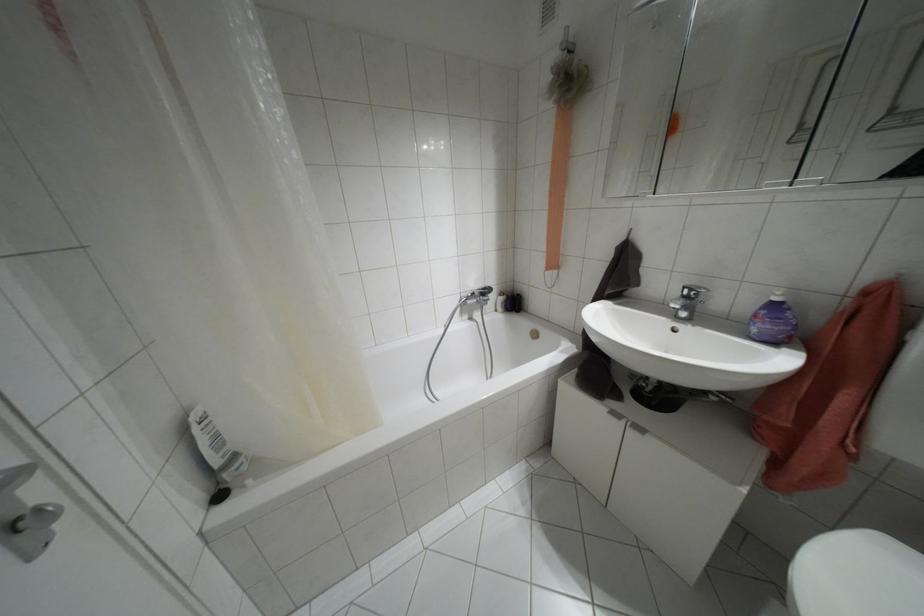
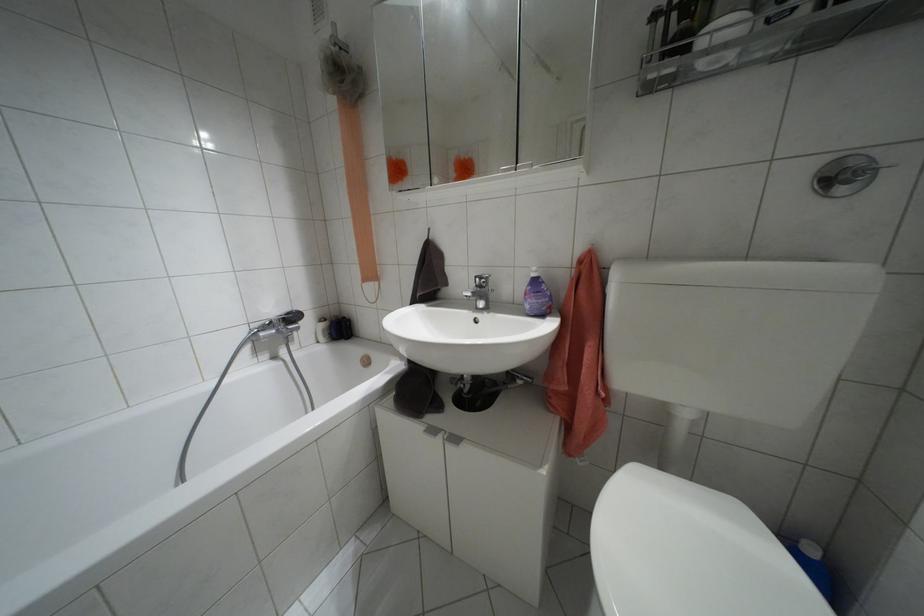
Where in the second image is the point corresponding to pixel 774 299 from the first image?

(532, 274)